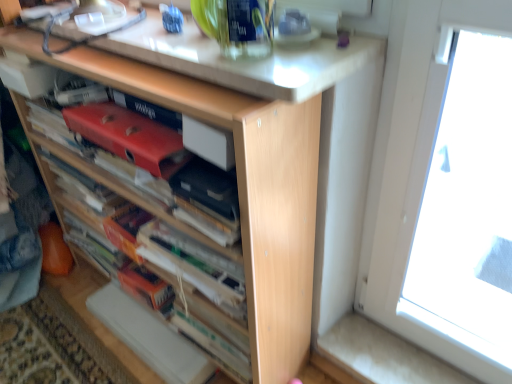
Question: Is matte red paperback book at center, the 2th paperback book positioned from the right, facing away from white glossy countertop at upper center?

Choices:
 (A) no
 (B) yes

Answer: (A)

Question: Can you confirm if matte red paperback book at center, positioned as the 1th paperback book in left-to-right order, is positioned to the right of white glossy countertop at upper center?

Choices:
 (A) no
 (B) yes

Answer: (A)

Question: From the image's perspective, is matte red paperback book at center, positioned as the 1th paperback book in left-to-right order, on top of white glossy countertop at upper center?

Choices:
 (A) no
 (B) yes

Answer: (A)

Question: From a real-world perspective, does matte red paperback book at center, the 2th paperback book positioned from the right, sit lower than white glossy countertop at upper center?

Choices:
 (A) no
 (B) yes

Answer: (B)

Question: Does matte red paperback book at center, the 2th paperback book positioned from the right, have a lesser height compared to white glossy countertop at upper center?

Choices:
 (A) yes
 (B) no

Answer: (B)

Question: Considering their positions, is matte red paperback book at center, positioned as the 1th paperback book in left-to-right order, located in front of or behind white glossy countertop at upper center?

Choices:
 (A) front
 (B) behind

Answer: (B)

Question: Is matte red paperback book at center, positioned as the 1th paperback book in left-to-right order, to the left or to the right of white glossy countertop at upper center in the image?

Choices:
 (A) left
 (B) right

Answer: (A)

Question: Is matte red paperback book at center, positioned as the 1th paperback book in left-to-right order, bigger or smaller than white glossy countertop at upper center?

Choices:
 (A) small
 (B) big

Answer: (A)

Question: Do you think matte red paperback book at center, positioned as the 1th paperback book in left-to-right order, is within white glossy countertop at upper center, or outside of it?

Choices:
 (A) outside
 (B) inside

Answer: (A)

Question: From the image's perspective, is matte black paperback book at center, positioned as the 1th paperback book in right-to-left order, located above or below wooden book at center?

Choices:
 (A) below
 (B) above

Answer: (B)

Question: Is matte black paperback book at center, positioned as the 1th paperback book in right-to-left order, situated inside wooden book at center or outside?

Choices:
 (A) inside
 (B) outside

Answer: (A)

Question: Considering their positions, is matte black paperback book at center, the 2th paperback book from the left, located in front of or behind wooden book at center?

Choices:
 (A) front
 (B) behind

Answer: (B)

Question: Does point (192, 165) appear closer or farther from the camera than point (94, 163)?

Choices:
 (A) farther
 (B) closer

Answer: (B)

Question: Visually, is matte black paperback book at center, the 2th paperback book from the left, positioned to the left or to the right of matte red paperback book at center, positioned as the 1th paperback book in left-to-right order?

Choices:
 (A) left
 (B) right

Answer: (B)

Question: From a real-world perspective, relative to matte red paperback book at center, the 2th paperback book positioned from the right, is matte black paperback book at center, the 2th paperback book from the left, vertically above or below?

Choices:
 (A) above
 (B) below

Answer: (B)